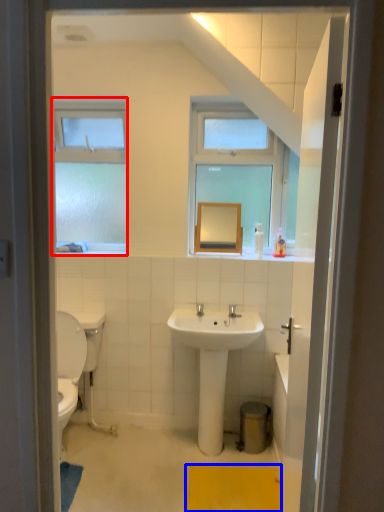
Question: Which object is further to the camera taking this photo, window (highlighted by a red box) or bath mat (highlighted by a blue box)?

Choices:
 (A) window
 (B) bath mat

Answer: (A)